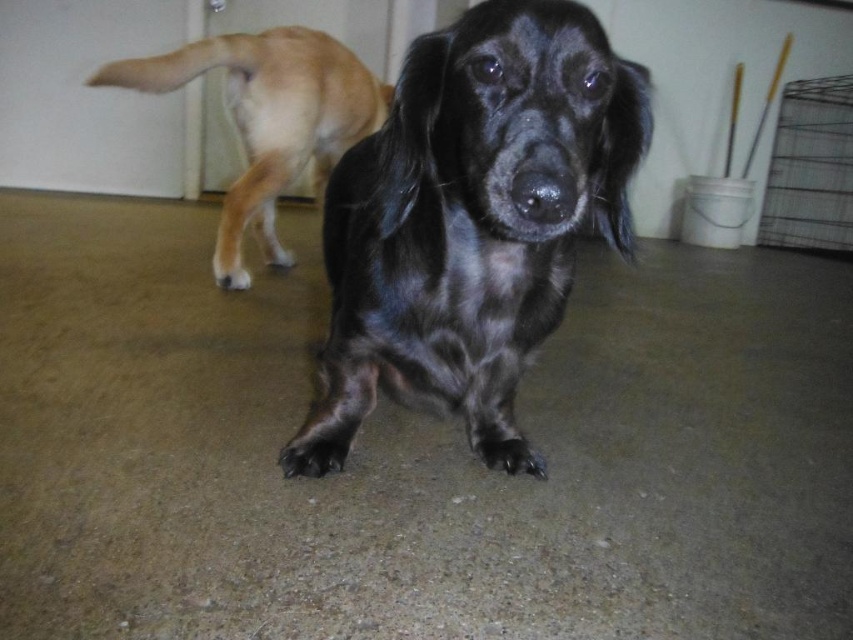
Can you confirm if shiny black dog at center is positioned to the left of shiny brown fur at upper left?

Incorrect, shiny black dog at center is not on the left side of shiny brown fur at upper left.

Which is below, shiny black dog at center or shiny brown fur at upper left?

shiny black dog at center is lower down.

Does point (607, 186) come in front of point (236, 77)?

That is True.

Locate an element on the screen. shiny black dog at center is located at coordinates (471, 220).